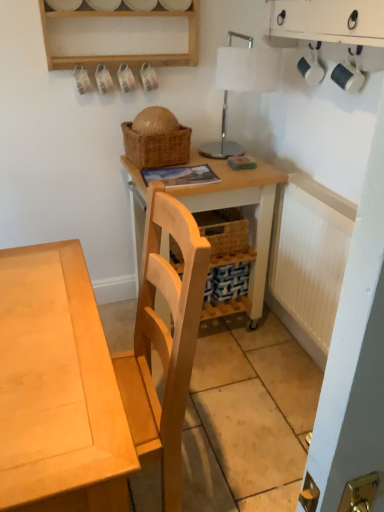
The width and height of the screenshot is (384, 512). Identify the location of white glossy table lamp at upper center. (222, 141).

What is the approximate width of light wood desk at center?

The width of light wood desk at center is 50.86 centimeters.

Where is `light wood desk at center`? The width and height of the screenshot is (384, 512). light wood desk at center is located at coordinates (57, 388).

The width and height of the screenshot is (384, 512). What are the coordinates of `woven brown picnic basket at upper center` in the screenshot? It's located at (157, 147).

Where is `white ribbed radiator at right`? Image resolution: width=384 pixels, height=512 pixels. white ribbed radiator at right is located at coordinates [x=308, y=260].

This screenshot has width=384, height=512. I want to click on wooden table at center, so click(240, 206).

Is light wood desk at center in front of or behind wooden table at center in the image?

light wood desk at center is in front of wooden table at center.

From the image's perspective, is light wood desk at center positioned above or below wooden table at center?

Clearly, from the image's perspective, light wood desk at center is below wooden table at center.

Could you tell me if light wood desk at center is turned towards wooden table at center?

No, light wood desk at center is not turned towards wooden table at center.

Does light wood desk at center have a greater width compared to wooden table at center?

Yes.

Considering the sizes of objects white ribbed radiator at right and woven brown picnic basket at upper center in the image provided, who is taller, white ribbed radiator at right or woven brown picnic basket at upper center?

With more height is white ribbed radiator at right.

Is white ribbed radiator at right facing towards woven brown picnic basket at upper center?

No, white ribbed radiator at right is not turned towards woven brown picnic basket at upper center.

Considering the relative sizes of white ribbed radiator at right and woven brown picnic basket at upper center in the image provided, is white ribbed radiator at right bigger than woven brown picnic basket at upper center?

Indeed, white ribbed radiator at right has a larger size compared to woven brown picnic basket at upper center.

Is white ribbed radiator at right completely or partially outside of woven brown picnic basket at upper center?

white ribbed radiator at right is positioned outside woven brown picnic basket at upper center.

Is wooden table at center taller than woven brown picnic basket at upper center?

Indeed, wooden table at center has a greater height compared to woven brown picnic basket at upper center.

You are a GUI agent. You are given a task and a screenshot of the screen. Output one action in this format:
    pyautogui.click(x=<x>, y=<y>)
    Task: Click on the picnic basket that appears above the wooden table at center (from a real-world perspective)
    The height and width of the screenshot is (512, 384).
    Given the screenshot: What is the action you would take?
    pyautogui.click(x=157, y=147)

Does wooden table at center lie in front of woven brown picnic basket at upper center?

Yes, the depth of wooden table at center is less than that of woven brown picnic basket at upper center.

Looking at this image, from a real-world perspective, who is located higher, wooden table at center or woven brown picnic basket at upper center?

woven brown picnic basket at upper center is physically above.

Based on the photo, which is more to the left, wooden table at center or white glossy table lamp at upper center?

Positioned to the left is wooden table at center.

Does wooden table at center have a greater width compared to white glossy table lamp at upper center?

Yes.

Looking at the image, does wooden table at center seem bigger or smaller compared to white glossy table lamp at upper center?

wooden table at center is bigger than white glossy table lamp at upper center.

From a real-world perspective, which object rests below the other?

white ribbed radiator at right, from a real-world perspective.

Which object is more forward, white ribbed radiator at right or light wood desk at center?

Positioned in front is light wood desk at center.

Who is bigger, white ribbed radiator at right or light wood desk at center?

light wood desk at center is bigger.

From the image's perspective, is light wood desk at center on top of white ribbed radiator at right?

Incorrect, from the image's perspective, light wood desk at center is lower than white ribbed radiator at right.

From a real-world perspective, which is physically below, light wood desk at center or white ribbed radiator at right?

white ribbed radiator at right is physically lower.

Considering the sizes of light wood desk at center and white ribbed radiator at right in the image, is light wood desk at center wider or thinner than white ribbed radiator at right?

In the image, light wood desk at center appears to be wider than white ribbed radiator at right.

Could you tell me if wooden table at center is turned towards white ribbed radiator at right?

Yes, wooden table at center is turned towards white ribbed radiator at right.

Consider the image. Is wooden table at center far from white ribbed radiator at right?

No, wooden table at center is in close proximity to white ribbed radiator at right.

Which object is closer to the camera, wooden table at center or white ribbed radiator at right?

white ribbed radiator at right is more forward.

Where is `radiator that is in front of the wooden table at center`? radiator that is in front of the wooden table at center is located at coordinates (308, 260).

Find the location of `desk below the wooden table at center (from the image's perspective)`. desk below the wooden table at center (from the image's perspective) is located at coordinates (57, 388).

This screenshot has width=384, height=512. Identify the location of picnic basket that appears behind the white ribbed radiator at right. pyautogui.click(x=157, y=147).

Estimate the real-world distances between objects in this image. Which object is further from white glossy table lamp at upper center, light wood desk at center or woven brown picnic basket at upper center?

light wood desk at center.

Considering their positions, is white ribbed radiator at right positioned closer to woven brown picnic basket at upper center than light wood desk at center?

Among the two, white ribbed radiator at right is located nearer to woven brown picnic basket at upper center.

Looking at the image, which one is located further to light wood desk at center, white ribbed radiator at right or white glossy table lamp at upper center?

white glossy table lamp at upper center is positioned further to the anchor light wood desk at center.

Based on their spatial positions, is woven brown picnic basket at upper center or white ribbed radiator at right closer to light wood desk at center?

woven brown picnic basket at upper center.

Looking at the image, which one is located closer to white ribbed radiator at right, light wood desk at center or wooden table at center?

Among the two, wooden table at center is located nearer to white ribbed radiator at right.

Which object lies further to the anchor point light wood desk at center, wooden table at center or white ribbed radiator at right?

white ribbed radiator at right is positioned further to the anchor light wood desk at center.

From the image, which object appears to be farther from woven brown picnic basket at upper center, wooden table at center or white glossy table lamp at upper center?

The object further to woven brown picnic basket at upper center is white glossy table lamp at upper center.

Estimate the real-world distances between objects in this image. Which object is further from white ribbed radiator at right, wooden table at center or white glossy table lamp at upper center?

white glossy table lamp at upper center is further to white ribbed radiator at right.

Locate an element on the screen. picnic basket between white glossy table lamp at upper center and light wood desk at center in the up-down direction is located at coordinates (157, 147).

You are a GUI agent. You are given a task and a screenshot of the screen. Output one action in this format:
    pyautogui.click(x=<x>, y=<y>)
    Task: Click on the table between white glossy table lamp at upper center and white ribbed radiator at right in the up-down direction
    The image size is (384, 512).
    Given the screenshot: What is the action you would take?
    [240, 206]

In order to click on table between woven brown picnic basket at upper center and white ribbed radiator at right from left to right in this screenshot , I will do `click(240, 206)`.

The height and width of the screenshot is (512, 384). I want to click on table located between light wood desk at center and woven brown picnic basket at upper center in the depth direction, so click(x=240, y=206).